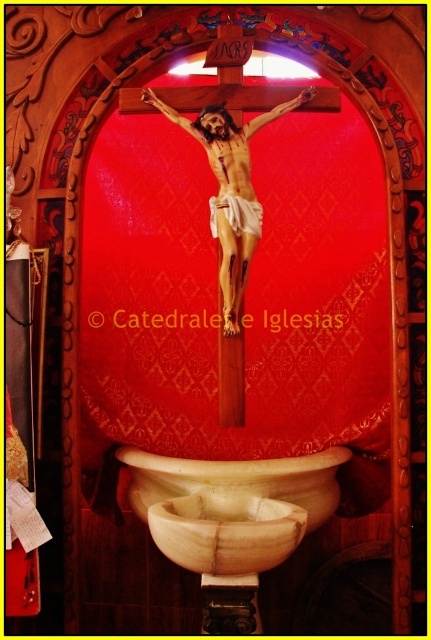
Question: Where is white marble basin at lower center located in relation to white marble sink at lower center in the image?

Choices:
 (A) above
 (B) below

Answer: (B)

Question: Is white marble basin at lower center to the right of white marble sink at lower center from the viewer's perspective?

Choices:
 (A) yes
 (B) no

Answer: (B)

Question: Does white marble basin at lower center have a greater width compared to white marble sink at lower center?

Choices:
 (A) no
 (B) yes

Answer: (A)

Question: Which point is closer to the camera?

Choices:
 (A) white marble sink at lower center
 (B) white marble basin at lower center

Answer: (B)